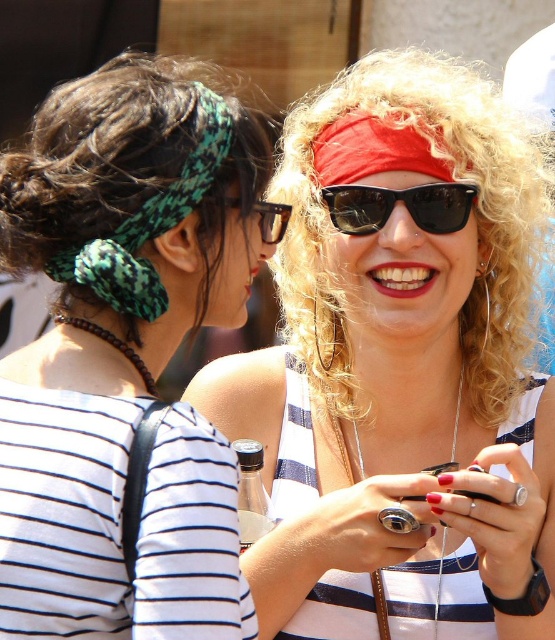
Consider the image. You are at a party and want to find the matte red bandana at center. Which direction should you look relative to the green knitted headscarf at upper left?

The matte red bandana at center is located to the right of the green knitted headscarf at upper left, so you should look to the right of the green knitted headscarf at upper left to find it.

You are standing in a crowd and want to locate two accessories in the image. The green woven headband at upper left and the black plastic sunglasses at center. Which accessory is nearer to you?

The green woven headband at upper left is closer to the viewer than the black plastic sunglasses at center.